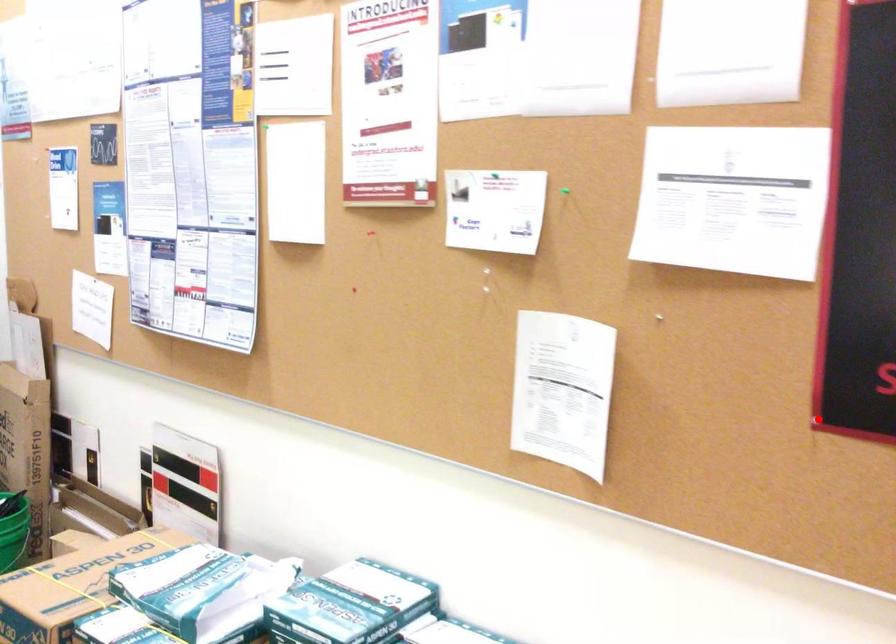
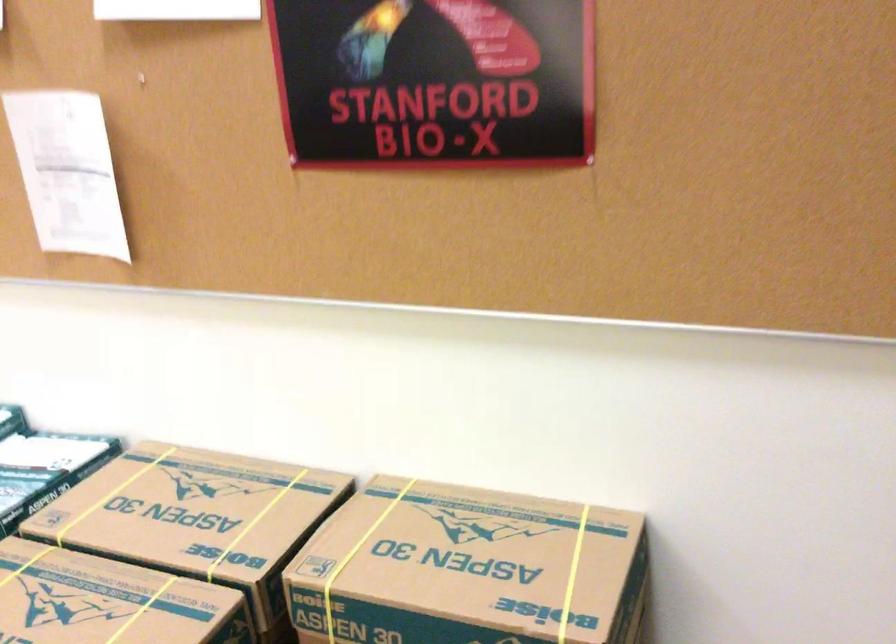
The point at the highlighted location is marked in the first image. Where is the corresponding point in the second image?

(291, 160)